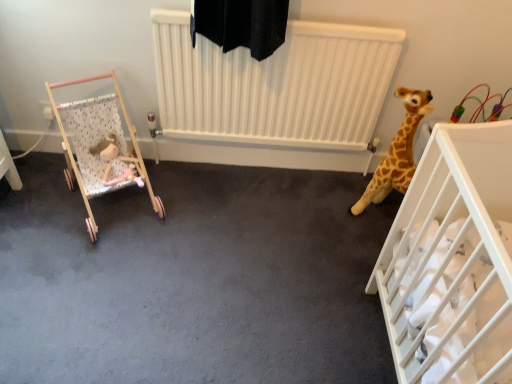
Question: Is white plastic crib at right, which is counted as the 2th infant bed, starting from the left, in front of or behind fluffy pink plush at left in the image?

Choices:
 (A) front
 (B) behind

Answer: (A)

Question: In terms of height, does white plastic crib at right, which is the first infant bed in right-to-left order, look taller or shorter compared to fluffy pink plush at left?

Choices:
 (A) tall
 (B) short

Answer: (A)

Question: Which object is positioned farthest from the fluffy pink plush at left?

Choices:
 (A) wooden stroller at left, arranged as the 2th infant bed when viewed from the right
 (B) white plastic crib at right, which is the first infant bed in right-to-left order

Answer: (B)

Question: Considering the real-world distances, which object is closest to the white plastic crib at right, which is the first infant bed in right-to-left order?

Choices:
 (A) wooden stroller at left, arranged as the 2th infant bed when viewed from the right
 (B) fluffy pink plush at left

Answer: (A)